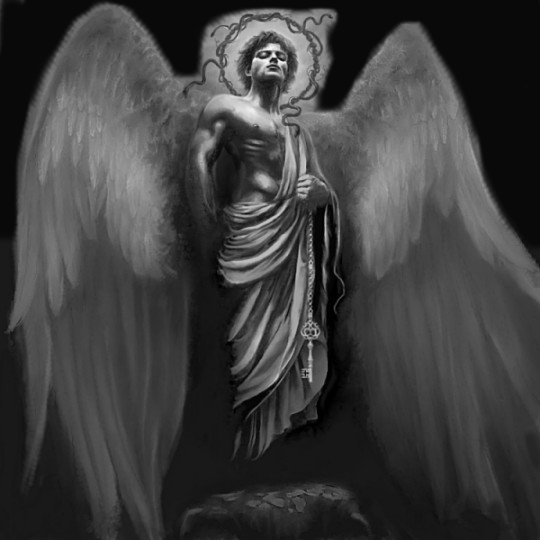
What are the coordinates of `1 robe` in the screenshot? It's located at (260, 384).